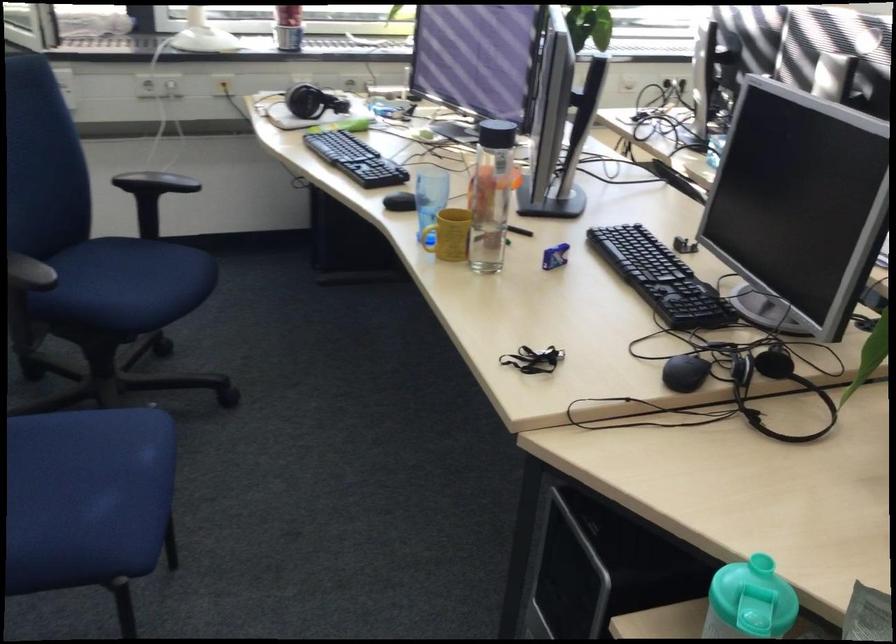
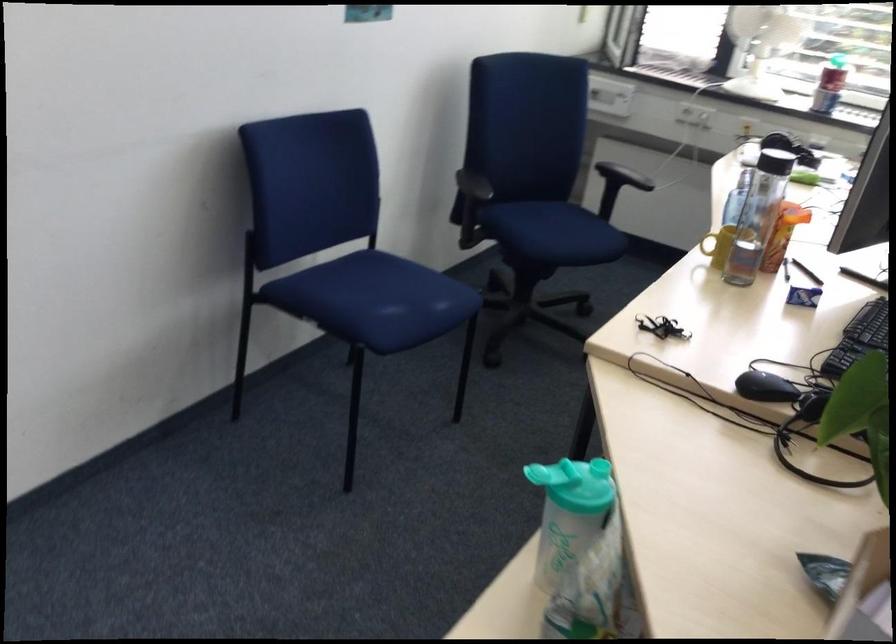
The point at (151,295) is marked in the first image. Where is the corresponding point in the second image?

(553, 232)